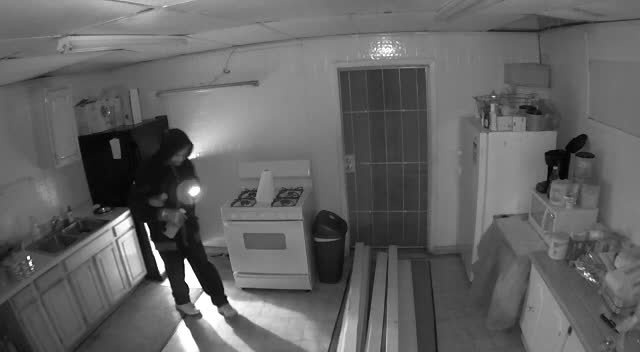
This screenshot has height=352, width=640. Find the location of `door lock`. door lock is located at coordinates (349, 161).